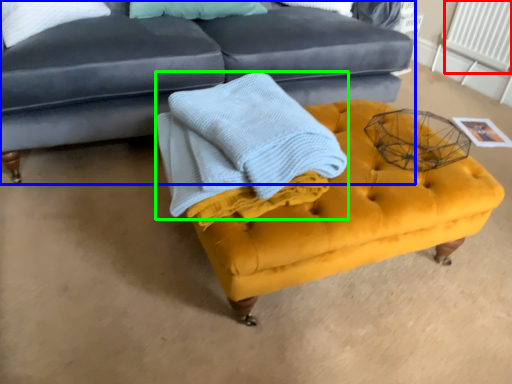
Question: Based on their relative distances, which object is farther from radiator (highlighted by a red box)? Choose from studio couch (highlighted by a blue box) and blanket (highlighted by a green box).

Choices:
 (A) studio couch
 (B) blanket

Answer: (B)